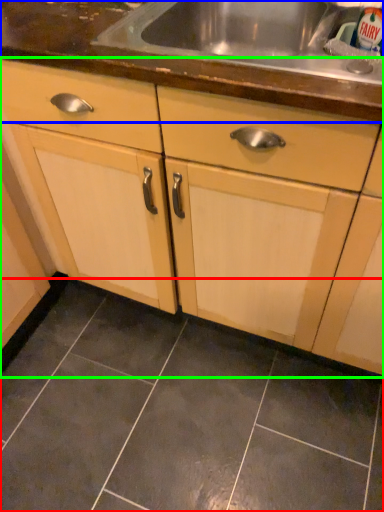
Question: Based on their relative distances, which object is nearer to ceramic tile (highlighted by a red box)? Choose from countertop (highlighted by a blue box) and cabinetry (highlighted by a green box).

Choices:
 (A) countertop
 (B) cabinetry

Answer: (B)